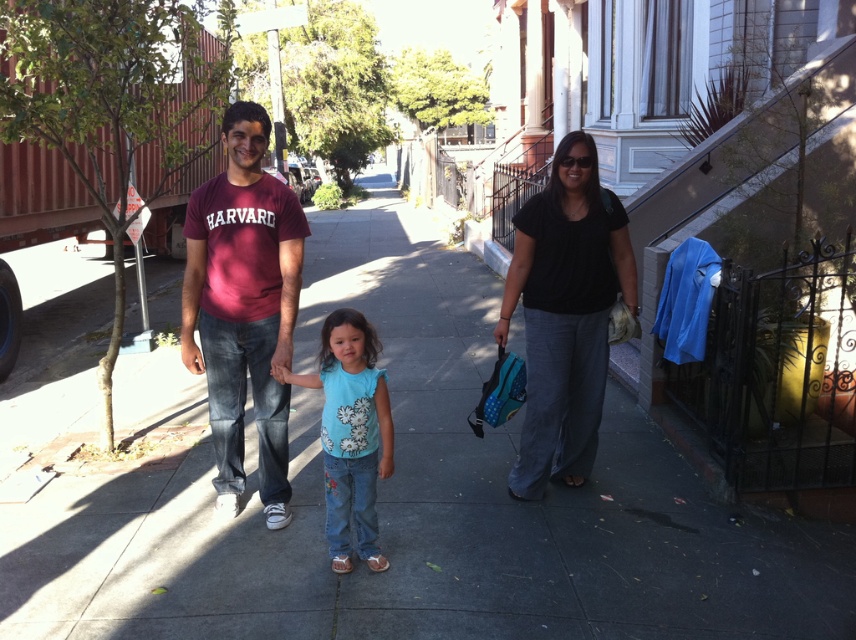
You are a fashion designer observing the family. You notice the black matte shirt at center and the light blue denim jeans at center. Which clothing item appears larger in size?

The black matte shirt at center is bigger than the light blue denim jeans at center.